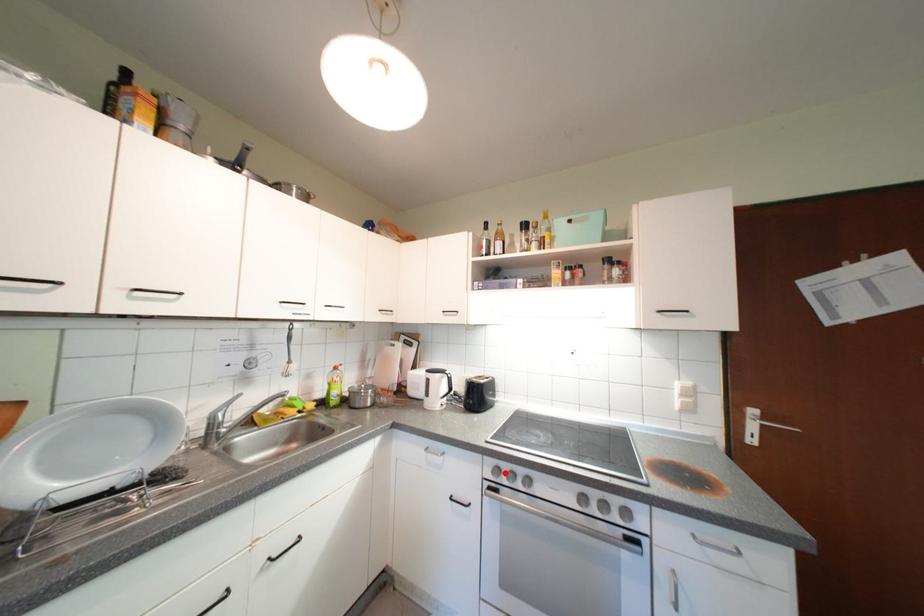
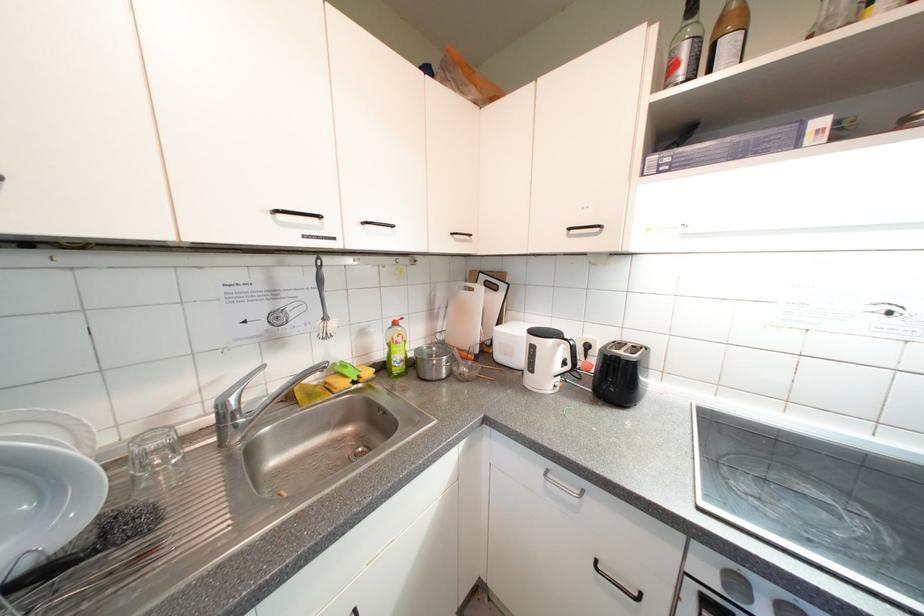
Locate, in the second image, the point that corresponds to the highlighted location in the first image.

(747, 586)